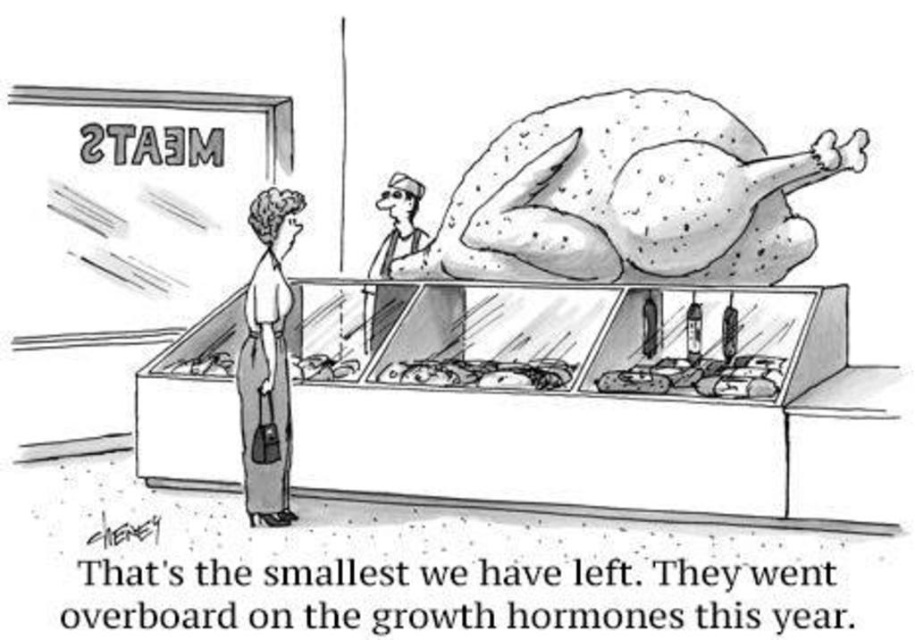
Who is taller, speckled white turkey at center or smooth beige pants at lower left?

With more height is smooth beige pants at lower left.

Is speckled white turkey at center bigger than smooth beige pants at lower left?

Yes.

At what (x,y) coordinates should I click in order to perform the action: click on speckled white turkey at center. Please return your answer as a coordinate pair (x, y). Looking at the image, I should click on (630, 196).

The width and height of the screenshot is (915, 640). Find the location of `speckled white turkey at center`. speckled white turkey at center is located at coordinates (630, 196).

Which is more to the left, speckled white turkey at center or shiny silver fish at center?

shiny silver fish at center

Identify the location of speckled white turkey at center. (630, 196).

In the scene shown: Who is positioned more to the left, smooth skin worker at upper center or shiny silver fish at center?

Positioned to the left is smooth skin worker at upper center.

Based on the photo, is smooth skin worker at upper center behind shiny silver fish at center?

Yes, smooth skin worker at upper center is further from the viewer.

Is point (380, 339) farther from camera compared to point (478, 385)?

Yes, it is behind point (478, 385).

The image size is (915, 640). I want to click on smooth skin worker at upper center, so click(x=397, y=221).